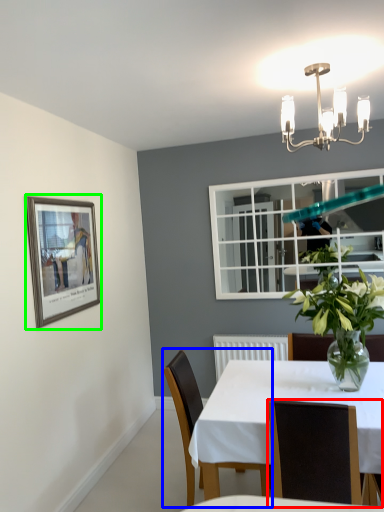
Question: Which is farther away from chair (highlighted by a red box)? chair (highlighted by a blue box) or picture frame (highlighted by a green box)?

Choices:
 (A) chair
 (B) picture frame

Answer: (B)